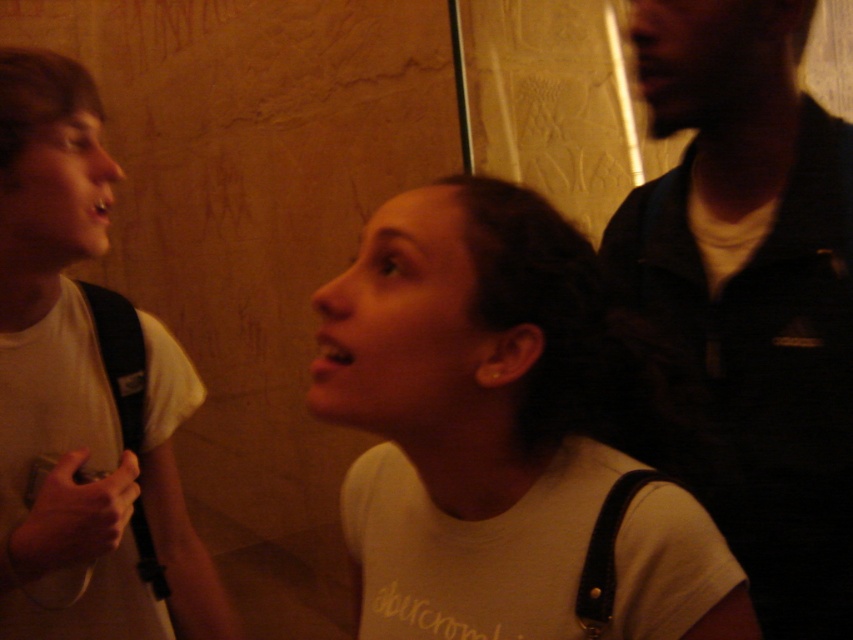
You are a photographer trying to capture a group photo of the white matte shirt at center and the dark blue shirt at upper right. The camera you are using has a maximum focus range of 10 inches. Will both subjects be in focus if you position the camera to aim at the midpoint between them?

The white matte shirt at center and dark blue shirt at upper right are 9.58 inches apart from each other. Since the distance between them is less than the camera maximum focus range of 10 inches, both subjects will be in focus when the camera is aimed at the midpoint between them.

You are standing in the hallway and want to reach the point at coordinates point (473, 340). If your height is 68 inches, will you be able to touch the point without bending down?

The distance between you and the point (473, 340) is 25.76 inches. Since your height is 68 inches, you can easily reach the point without bending down as it is within your reach.

You are trying to decide which shirt to buy for a party. The white matte shirt at center and the dark blue shirt at upper right are both in your size. Which one has a wider fit?

The white matte shirt at center is wider than the dark blue shirt at upper right, so it might provide a more comfortable fit for the party.